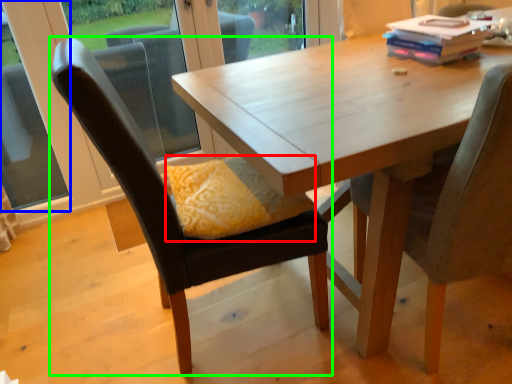
Question: Considering the real-world distances, which object is farthest from pillow (highlighted by a red box)? window (highlighted by a blue box) or chair (highlighted by a green box)?

Choices:
 (A) window
 (B) chair

Answer: (A)